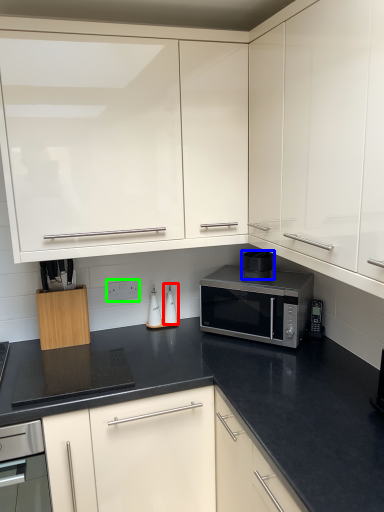
Question: Which object is positioned farthest from appliance (highlighted by a red box)? Select from appliance (highlighted by a blue box) and electric outlet (highlighted by a green box).

Choices:
 (A) appliance
 (B) electric outlet

Answer: (A)